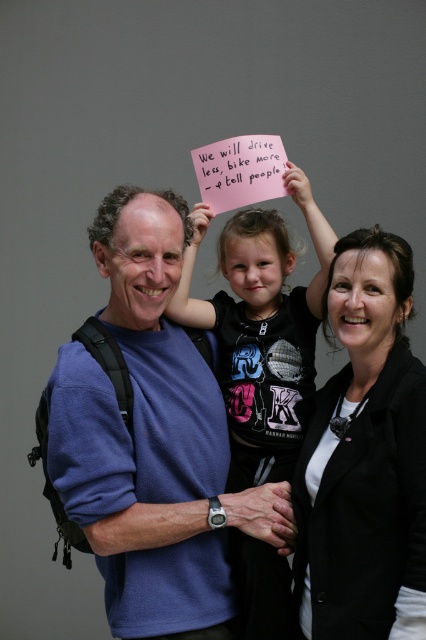
Does black matte blazer at center have a lesser height compared to black matte shirt at center?

Yes, black matte blazer at center is shorter than black matte shirt at center.

Which is in front, point (393, 458) or point (193, 214)?

Point (393, 458) is in front.

At what (x,y) coordinates should I click in order to perform the action: click on black matte blazer at center. Please return your answer as a coordinate pair (x, y). This screenshot has height=640, width=426. Looking at the image, I should click on (365, 458).

Does point (198, 356) lie in front of point (351, 310)?

No, it is behind (351, 310).

Is the position of blue fabric shirt at center less distant than that of black matte blazer at center?

No, it is behind black matte blazer at center.

What do you see at coordinates (152, 442) in the screenshot?
I see `blue fabric shirt at center` at bounding box center [152, 442].

Where is `blue fabric shirt at center`? The width and height of the screenshot is (426, 640). blue fabric shirt at center is located at coordinates (152, 442).

Is point (103, 316) closer to camera compared to point (222, 346)?

That is True.

Measure the distance from blue fabric shirt at center to black matte shirt at center.

They are 7.82 inches apart.

Who is more distant from viewer, (x=71, y=460) or (x=267, y=298)?

The point (x=267, y=298) is more distant.

Locate an element on the screen. The height and width of the screenshot is (640, 426). blue fabric shirt at center is located at coordinates (152, 442).